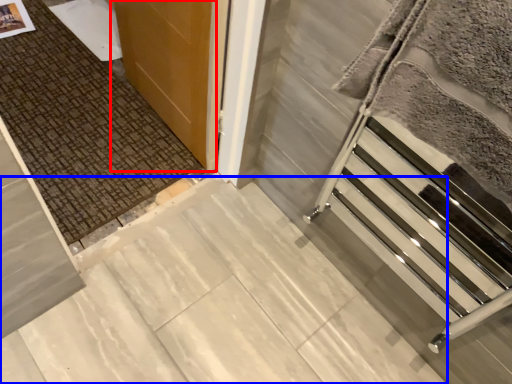
Question: Among these objects, which one is farthest to the camera, door (highlighted by a red box) or concrete (highlighted by a blue box)?

Choices:
 (A) door
 (B) concrete

Answer: (A)